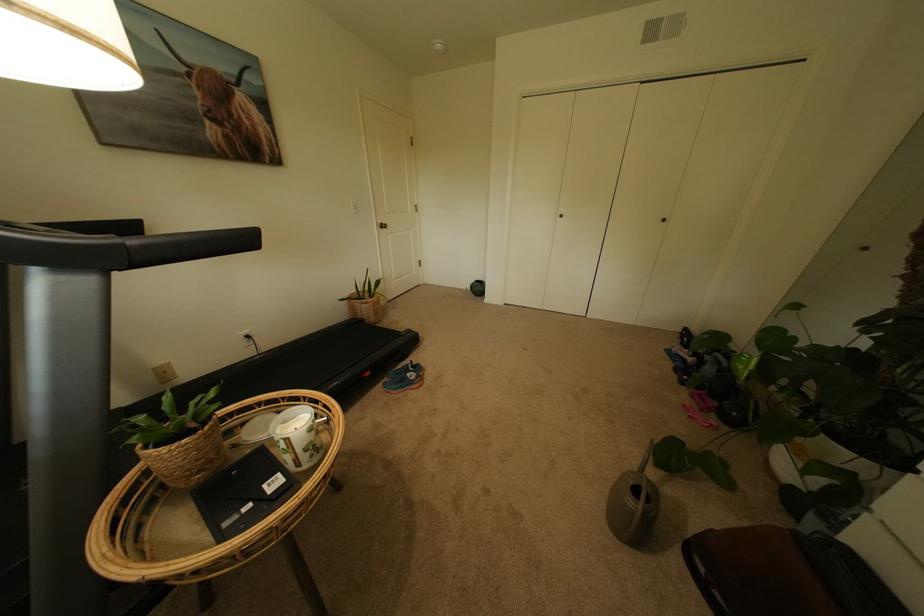
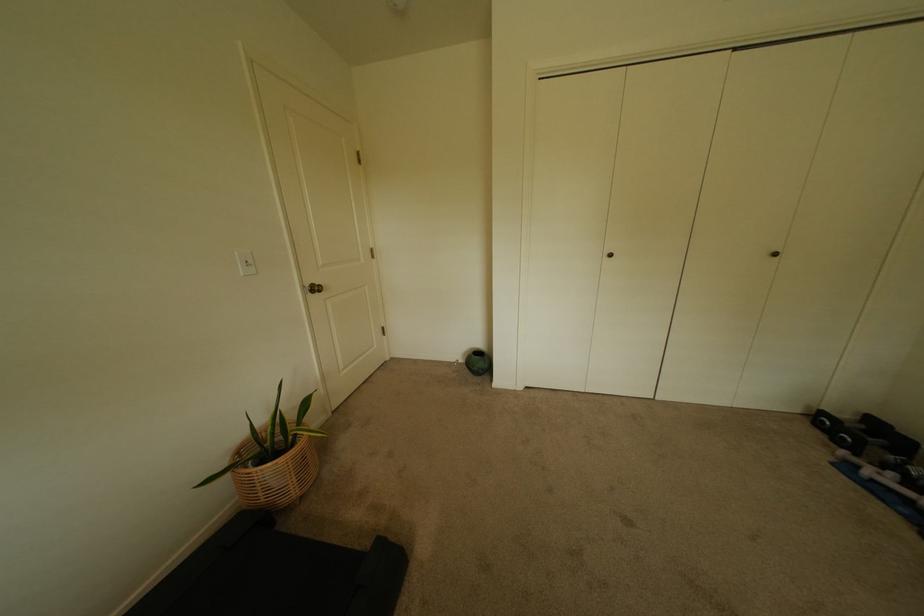
In the second image, find the point that corresponds to (695,331) in the first image.

(831, 415)